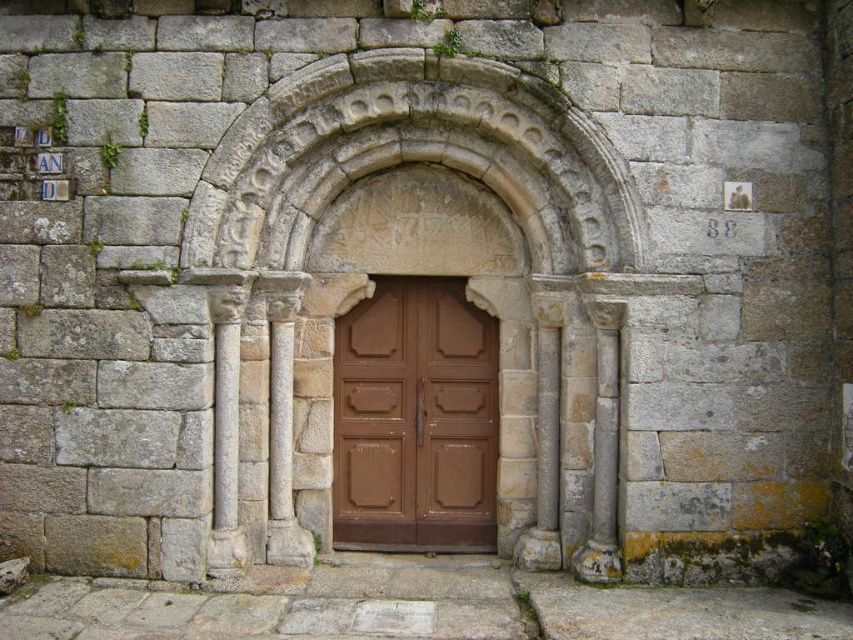
Question: From the image, what is the correct spatial relationship of carved stone arch at center in relation to brown matte door at center?

Choices:
 (A) below
 (B) above

Answer: (B)

Question: Does carved stone arch at center appear on the left side of brown matte door at center?

Choices:
 (A) no
 (B) yes

Answer: (B)

Question: Does carved stone arch at center appear under brown matte door at center?

Choices:
 (A) yes
 (B) no

Answer: (B)

Question: Which point is closer to the camera?

Choices:
 (A) (474, 160)
 (B) (347, 515)

Answer: (A)

Question: Among these objects, which one is farthest from the camera?

Choices:
 (A) brown matte door at center
 (B) carved stone arch at center

Answer: (A)

Question: Which point is farther to the camera?

Choices:
 (A) brown matte door at center
 (B) carved stone arch at center

Answer: (A)